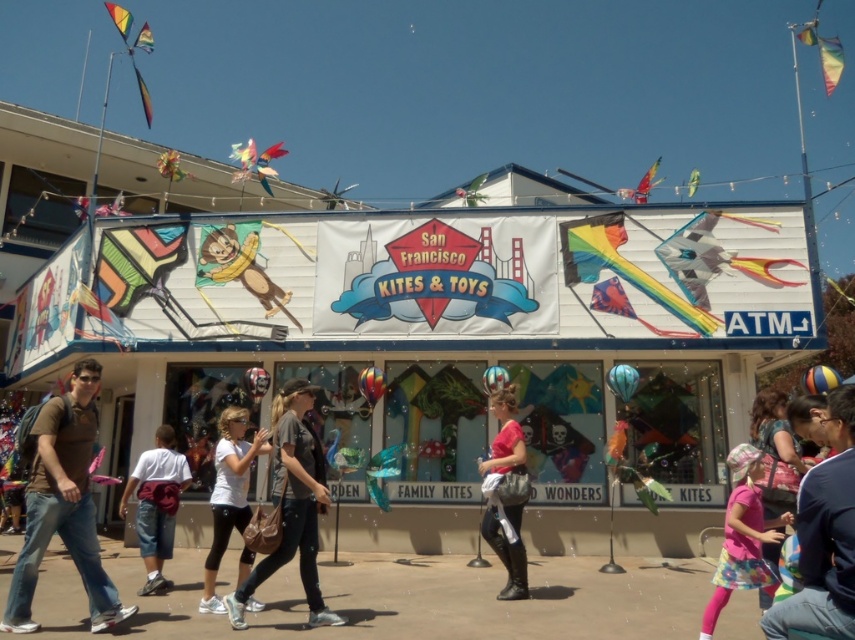
Question: Which of these objects is positioned farthest from the multicolored fabric kite at upper center?

Choices:
 (A) white cotton shirt at left
 (B) pink fabric dress at lower right
 (C) pink floral dress at lower right
 (D) matte pink shirt at center

Answer: (B)

Question: Does rainbow fabric kite at upper right have a larger size compared to multicolored fabric kite at upper center?

Choices:
 (A) yes
 (B) no

Answer: (B)

Question: Which object is closer to the camera taking this photo?

Choices:
 (A) matte pink shirt at center
 (B) pink floral dress at lower right
 (C) shiny metallic kite at upper center
 (D) rainbow fabric kite at upper right

Answer: (B)

Question: Which of the following is the closest to the observer?

Choices:
 (A) (575, 248)
 (B) (842, 602)

Answer: (B)

Question: Is dark gray t-shirt at center positioned in front of matte pink shirt at center?

Choices:
 (A) yes
 (B) no

Answer: (A)

Question: Can you confirm if pink floral dress at lower right is positioned to the left of multicolored fabric kite at upper center?

Choices:
 (A) yes
 (B) no

Answer: (B)